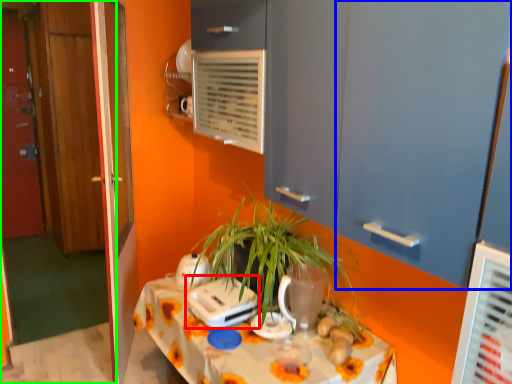
Question: Which object is the farthest from appliance (highlighted by a red box)? Choose among these: door (highlighted by a blue box) or door (highlighted by a green box).

Choices:
 (A) door
 (B) door

Answer: (B)